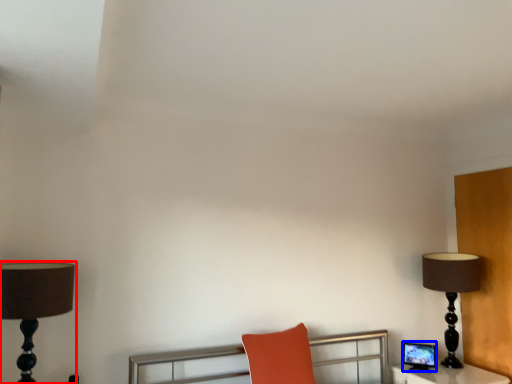
Question: Which point is further to the camera, lamp (highlighted by a red box) or computer monitor (highlighted by a blue box)?

Choices:
 (A) lamp
 (B) computer monitor

Answer: (B)